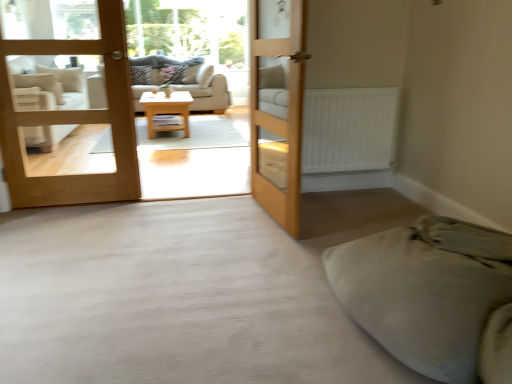
Question: From a real-world perspective, relative to soft beige blanket at lower right, is wooden bunk bed at center vertically above or below?

Choices:
 (A) below
 (B) above

Answer: (B)

Question: From their relative heights in the image, would you say wooden bunk bed at center is taller or shorter than soft beige blanket at lower right?

Choices:
 (A) tall
 (B) short

Answer: (A)

Question: Which of these objects is positioned closest to the wooden bunk bed at center?

Choices:
 (A) light wood/texture coffee table at center
 (B) light brown wood door at left, the first door from the left
 (C) transparent glass window screen at upper center
 (D) patterned fabric pillow at center, the first pillow in the left-to-right sequence
 (E) white fabric armchair at left

Answer: (B)

Question: Considering the real-world distances, which object is farthest from the patterned fabric pillow at center, the second pillow in the right-to-left sequence?

Choices:
 (A) patterned fabric pillow at center, which is the second pillow in left-to-right order
 (B) light wood/texture coffee table at center
 (C) transparent glass window screen at upper center
 (D) light brown wood door at left, the first door from the left
 (E) wooden bunk bed at center

Answer: (D)